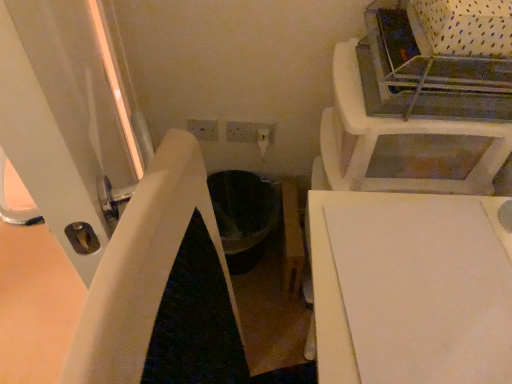
Locate an element on the screen. white matte board at center is located at coordinates (411, 289).

What do you see at coordinates (411, 289) in the screenshot? I see `white matte board at center` at bounding box center [411, 289].

I want to click on white matte board at center, so click(411, 289).